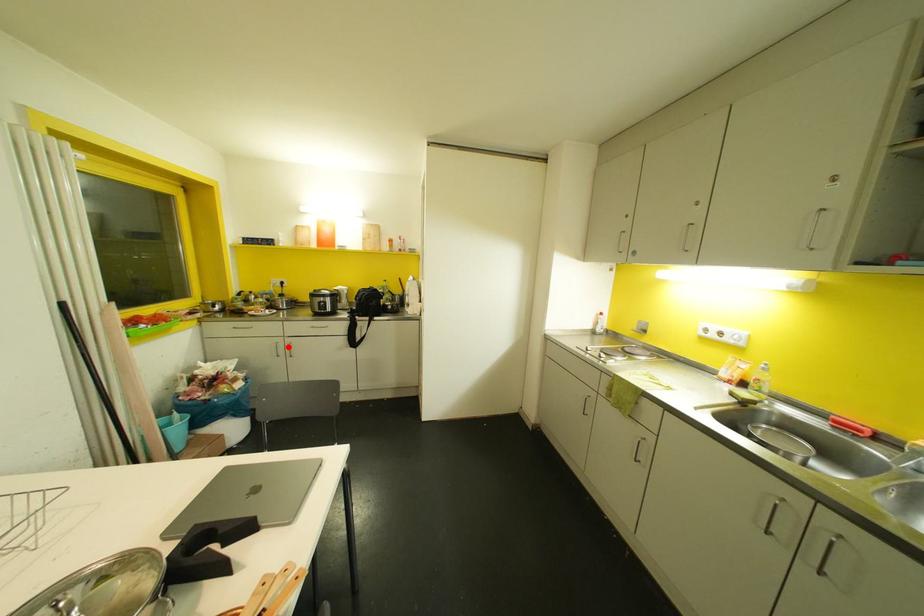
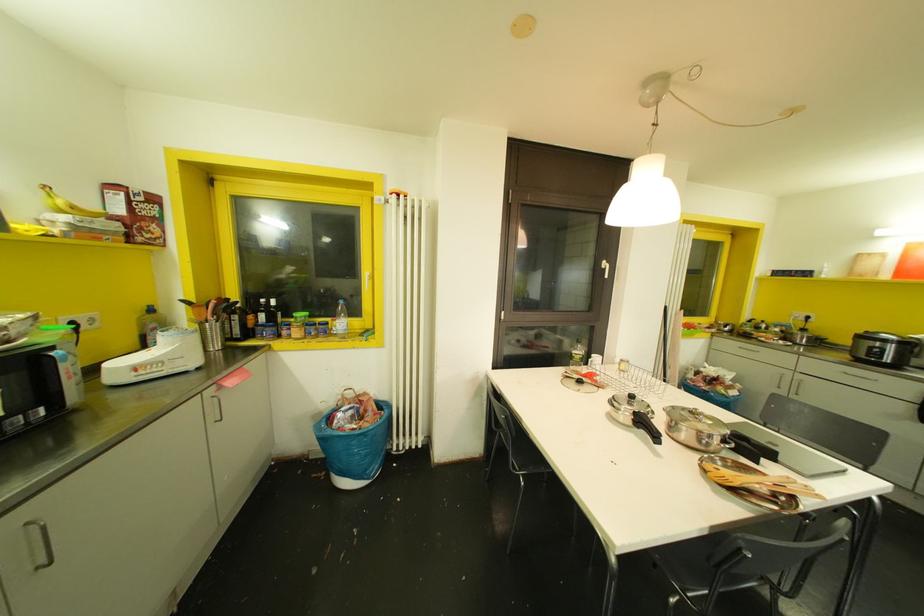
Question: I am providing you with two images of the same scene from different viewpoints. A red point is marked on the first image. Is the red point's position out of view in image 2?

Choices:
 (A) Yes
 (B) No

Answer: (B)